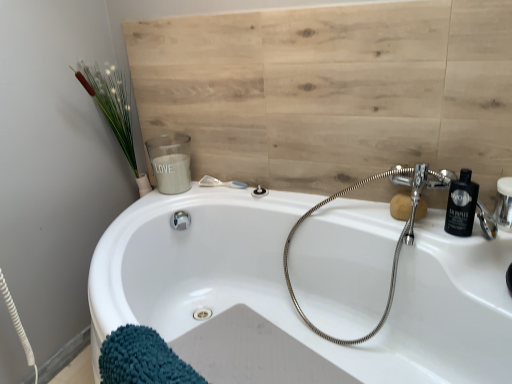
Question: Is point (437, 269) positioned closer to the camera than point (402, 240)?

Choices:
 (A) farther
 (B) closer

Answer: (B)

Question: Considering their positions, is white glossy bathtub at center located in front of or behind chrome flexible hose at upper right?

Choices:
 (A) behind
 (B) front

Answer: (B)

Question: Estimate the real-world distances between objects in this image. Which object is farther from the matte silver shower at upper center, the second shower when ordered from left to right?

Choices:
 (A) black plastic bottle at upper right
 (B) chrome flexible hose at upper right
 (C) white glossy bathtub at center
 (D) white matte candle at upper left
 (E) clear plastic shower at upper center, the second shower in the right-to-left sequence

Answer: (A)

Question: Which object is the closest to the clear plastic shower at upper center, the second shower in the right-to-left sequence?

Choices:
 (A) white glossy bathtub at center
 (B) chrome flexible hose at upper right
 (C) matte silver shower at upper center, marked as the first shower in a right-to-left arrangement
 (D) white matte candle at upper left
 (E) black plastic bottle at upper right

Answer: (C)